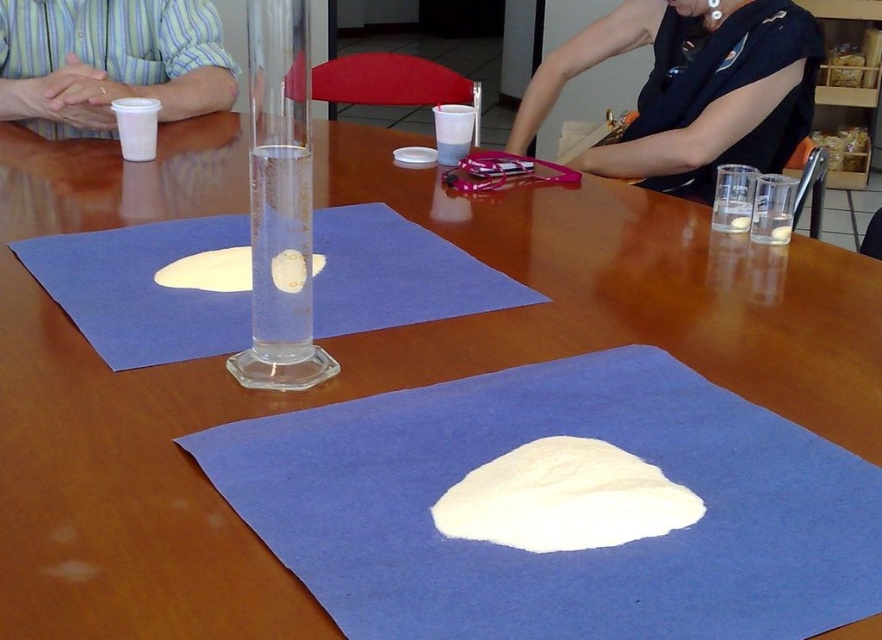
You are a fashion designer who needs to place the striped cotton shirt at left and the white fluffy dough at center on a display table. According to the scene, which object should be placed to the left side of the display table?

The striped cotton shirt at left should be placed to the left side of the display table because it is already positioned to the left of the white fluffy dough at center in the scene.